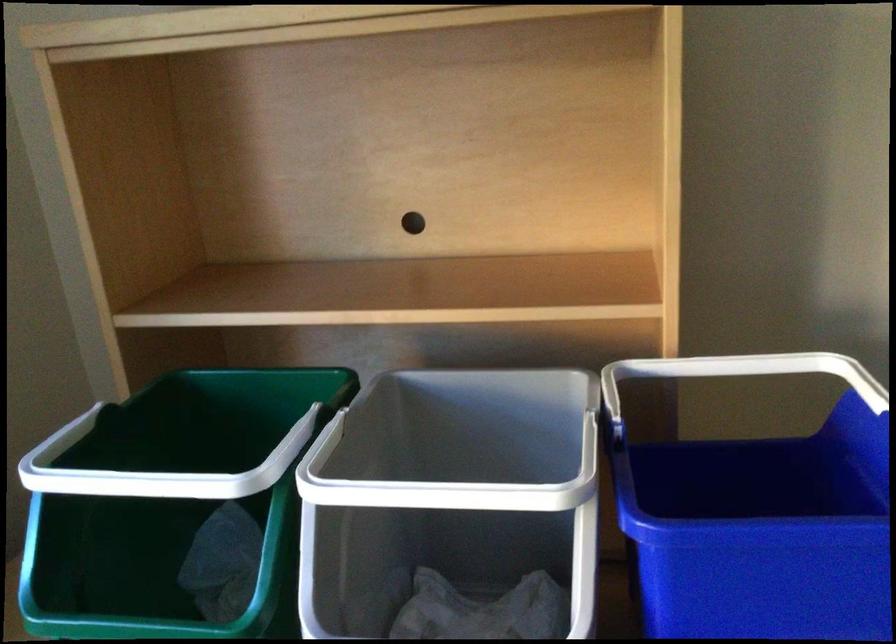
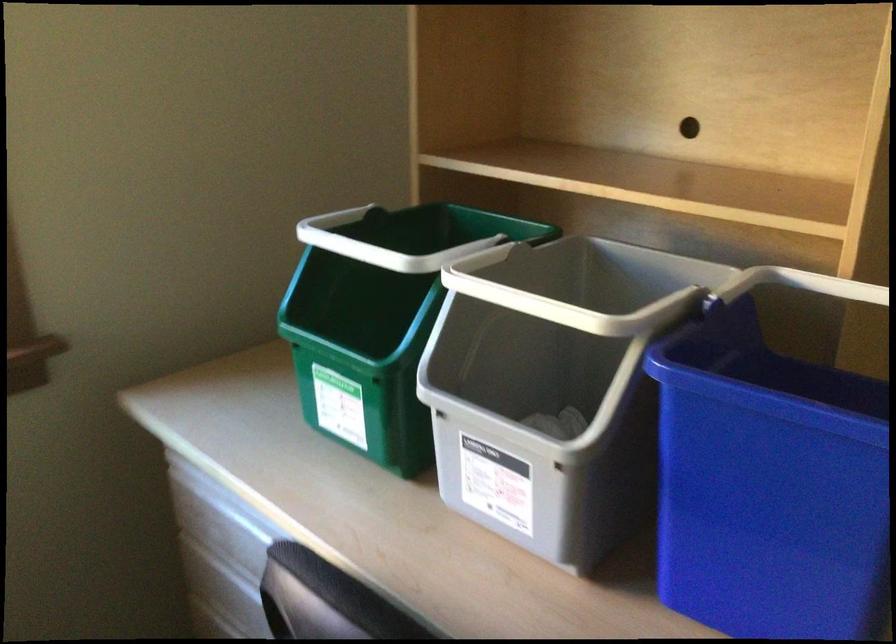
Question: Based on the continuous images, in which direction is the camera rotating? Reply with the corresponding letter.

Choices:
 (A) Left
 (B) Right
 (C) Up
 (D) Down

Answer: (A)